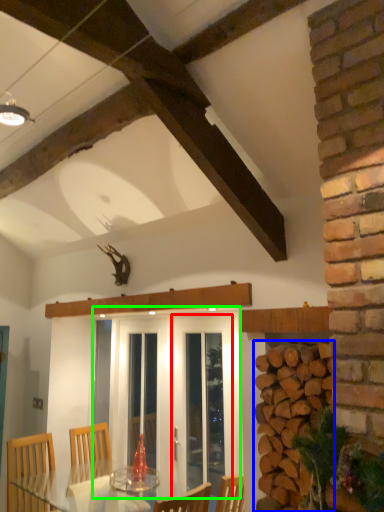
Question: Which object is the closest to the screen door (highlighted by a red box)? Choose among these: brickwork (highlighted by a blue box) or screen door (highlighted by a green box).

Choices:
 (A) brickwork
 (B) screen door

Answer: (B)